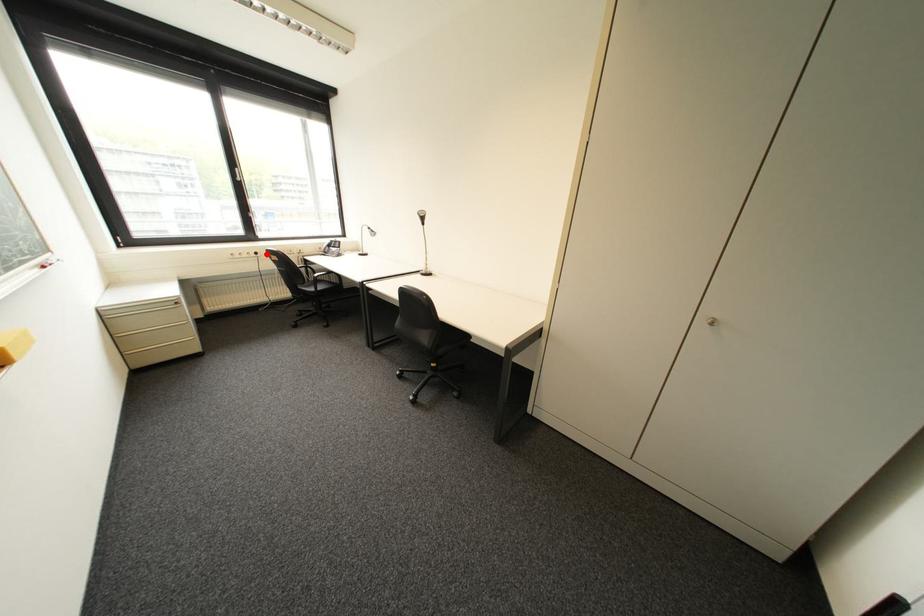
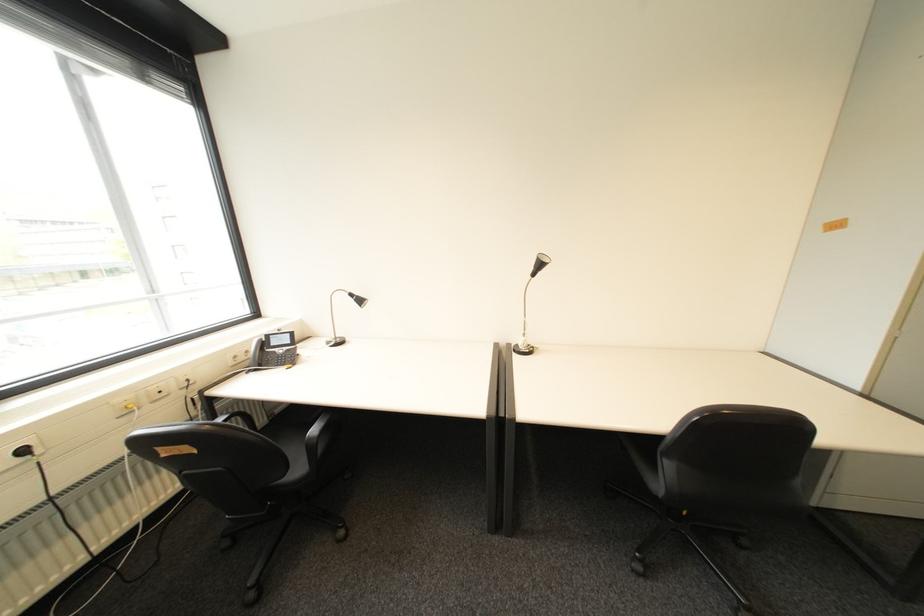
The point at the highlighted location is marked in the first image. Where is the corresponding point in the second image?

(34, 452)